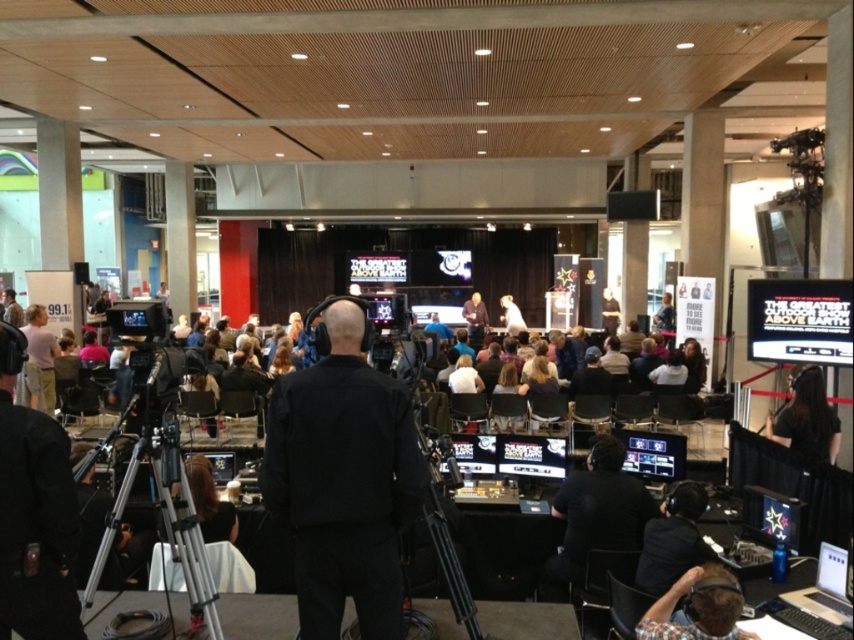
Question: Can you confirm if black matte camera at left is wider than black hair at center?

Choices:
 (A) no
 (B) yes

Answer: (A)

Question: Which object is positioned closest to the black hair at center?

Choices:
 (A) plaid shirt at lower right
 (B) black matte jacket at center
 (C) black matte camera at left

Answer: (A)

Question: Based on their relative distances, which object is farther from the silver metallic tripod at lower left?

Choices:
 (A) black hair at center
 (B) black matte camera at left
 (C) black matte jacket at center
 (D) plaid shirt at lower right

Answer: (A)

Question: Which point is closer to the camera?

Choices:
 (A) (313, 637)
 (B) (161, 428)

Answer: (A)

Question: Does black matte jacket at center come in front of plaid shirt at lower right?

Choices:
 (A) yes
 (B) no

Answer: (A)

Question: Is black matte camera at left wider than black hair at center?

Choices:
 (A) yes
 (B) no

Answer: (B)